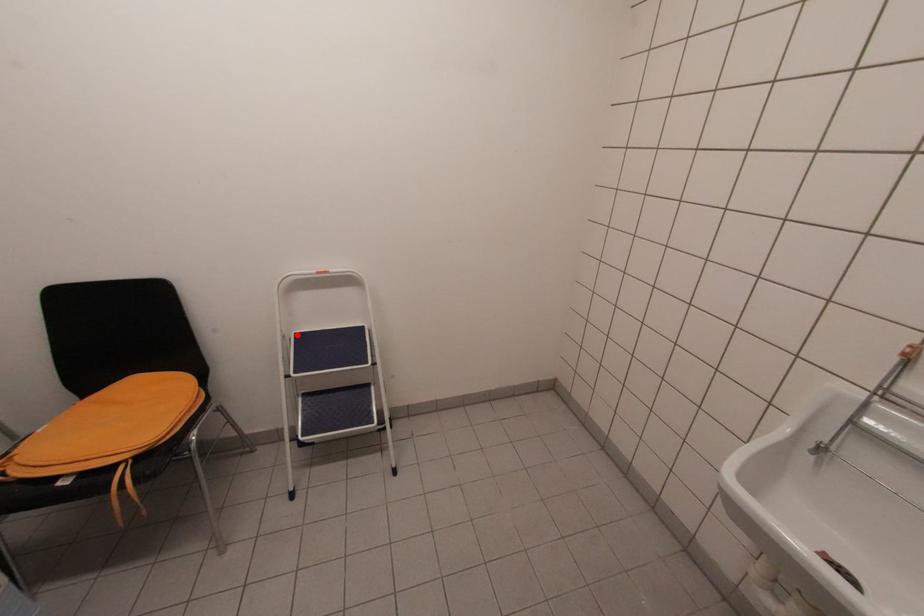
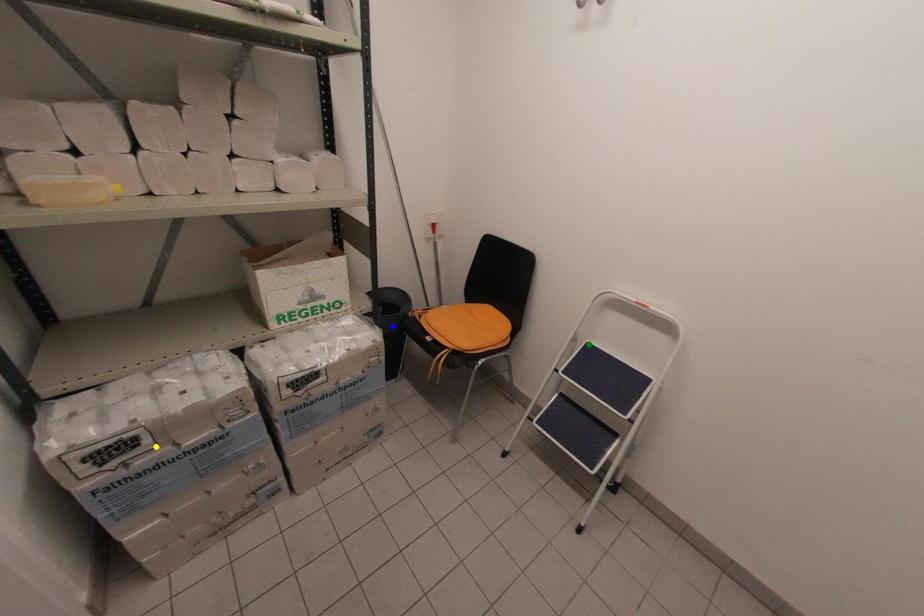
Question: I am providing you with two images of the same scene from different viewpoints. A red point is marked on the first image. You are given multiple points on the second image. Which point in image 2 is actually the same real-world point as the red point in image 1?

Choices:
 (A) green point
 (B) yellow point
 (C) blue point

Answer: (A)